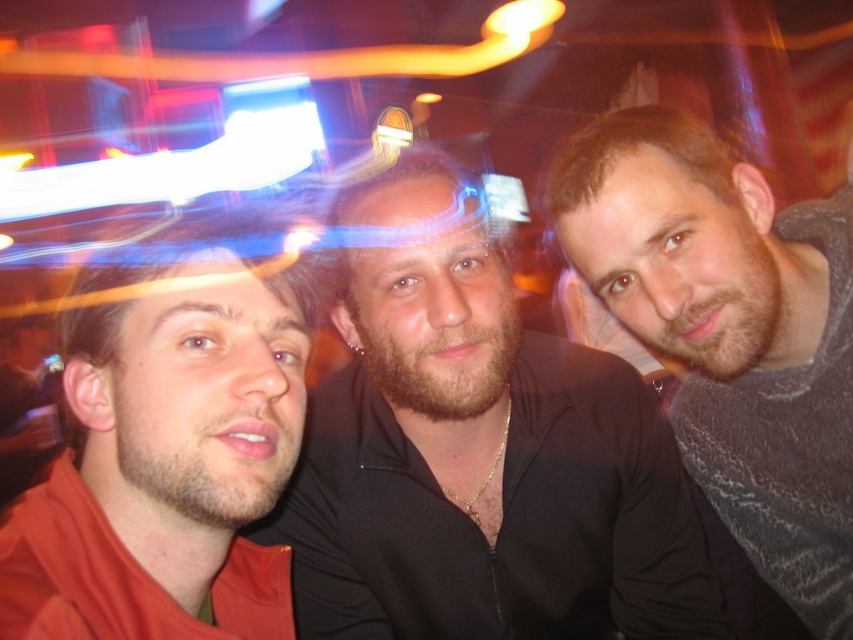
You are organizing a clothing display and need to arrange the smooth black shirt at center and the gray textured hoodie at right based on their sizes. Which one should you place first if you want to arrange from largest to smallest?

The smooth black shirt at center should be placed first since its width surpasses that of the gray textured hoodie at right, making it larger in size.

You are a photographer trying to adjust the focus of your camera. You want to focus on the matte orange shirt at left and the gray textured hoodie at right. Which one should you focus on first to ensure both are in focus?

You should focus on the matte orange shirt at left first since it is closer to the viewer than the gray textured hoodie at right, so adjusting focus starting from the closer object will help ensure both are in focus.

You are at a party and want to hand a drink to the person wearing the smooth black shirt at center without disturbing the person in the gray textured hoodie at right. Based on their positions, where should you approach from?

The smooth black shirt at center is located below the gray textured hoodie at right, so you should approach from the lower area near the smooth black shirt at center to avoid disturbing the gray textured hoodie at right.